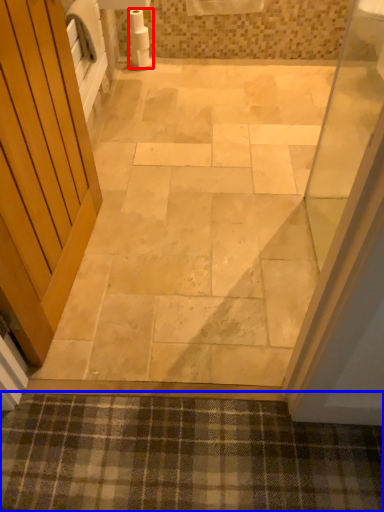
Question: Which object is further to the camera taking this photo, toilet paper (highlighted by a red box) or bath mat (highlighted by a blue box)?

Choices:
 (A) toilet paper
 (B) bath mat

Answer: (A)